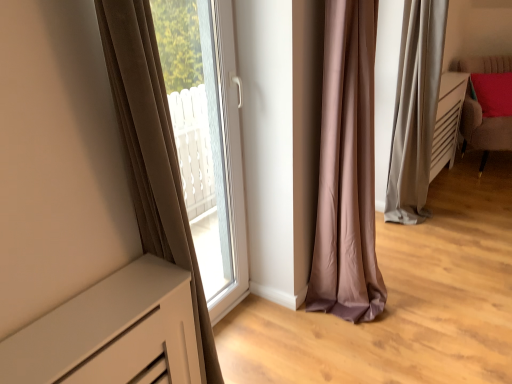
Question: Should I look upward or downward to see velvet red cushion at right?

Choices:
 (A) down
 (B) up

Answer: (B)